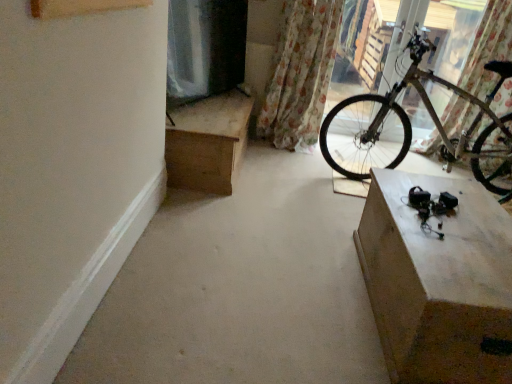
Identify the location of white smooth baseboard at lower left. The width and height of the screenshot is (512, 384). (86, 291).

Where is `floral fabric curtain at upper right, marked as the first curtain in a right-to-left arrangement`? The height and width of the screenshot is (384, 512). floral fabric curtain at upper right, marked as the first curtain in a right-to-left arrangement is located at coordinates (488, 48).

Measure the distance between smooth concrete at center and camera.

smooth concrete at center is 4.68 feet from camera.

Identify the location of wooden desk at upper left. (207, 142).

Can you confirm if metallic silver bicycle at right is smaller than smooth concrete at center?

No, metallic silver bicycle at right is not smaller than smooth concrete at center.

Measure the distance between metallic silver bicycle at right and smooth concrete at center.

They are 1.26 meters apart.

From the image's perspective, would you say metallic silver bicycle at right is shown under smooth concrete at center?

No, from the image's perspective, metallic silver bicycle at right is not below smooth concrete at center.

Is metallic silver bicycle at right inside or outside of smooth concrete at center?

metallic silver bicycle at right is not inside smooth concrete at center, it's outside.

Looking at this image, between wooden desk at upper left and matte concrete cabinet at lower right, which one has more height?

wooden desk at upper left.

Which point is more distant from viewer, (213, 144) or (489, 204)?

Point (213, 144)

Considering their positions, is wooden desk at upper left located in front of or behind matte concrete cabinet at lower right?

Visually, wooden desk at upper left is located behind matte concrete cabinet at lower right.

From a real-world perspective, is floral fabric curtain at upper right, which ranks as the 2th curtain in right-to-left order, on smooth concrete at center?

Indeed, from a real-world perspective, floral fabric curtain at upper right, which ranks as the 2th curtain in right-to-left order, stands above smooth concrete at center.

Is floral fabric curtain at upper right, which ranks as the 2th curtain in right-to-left order, in front of smooth concrete at center?

That is False.

Is floral fabric curtain at upper right, which ranks as the 2th curtain in right-to-left order, bigger than smooth concrete at center?

Incorrect, floral fabric curtain at upper right, which ranks as the 2th curtain in right-to-left order, is not larger than smooth concrete at center.

Is wooden desk at upper left positioned with its back to floral fabric curtain at upper right, marked as the first curtain in a right-to-left arrangement?

wooden desk at upper left is not turned away from floral fabric curtain at upper right, marked as the first curtain in a right-to-left arrangement.

Looking at their sizes, would you say wooden desk at upper left is wider or thinner than floral fabric curtain at upper right, marked as the first curtain in a right-to-left arrangement?

wooden desk at upper left is wider than floral fabric curtain at upper right, marked as the first curtain in a right-to-left arrangement.

Who is shorter, wooden desk at upper left or floral fabric curtain at upper right, which appears as the 2th curtain when viewed from the left?

wooden desk at upper left.

Choose the correct answer: Is wooden desk at upper left inside floral fabric curtain at upper right, marked as the first curtain in a right-to-left arrangement, or outside it?

The correct answer is: outside.

Does point (106, 263) lie behind point (152, 284)?

No, it is not.

Which object is closer to the camera taking this photo, white smooth baseboard at lower left or smooth concrete at center?

white smooth baseboard at lower left.

Is white smooth baseboard at lower left turned away from smooth concrete at center?

No, smooth concrete at center is not at the back of white smooth baseboard at lower left.

Considering the relative positions of white smooth baseboard at lower left and matte concrete cabinet at lower right in the image provided, is white smooth baseboard at lower left in front of matte concrete cabinet at lower right?

Yes.

Based on the photo, is white smooth baseboard at lower left facing towards matte concrete cabinet at lower right?

Yes, white smooth baseboard at lower left faces towards matte concrete cabinet at lower right.

What's the angular difference between white smooth baseboard at lower left and matte concrete cabinet at lower right's facing directions?

179 degrees.

Between white smooth baseboard at lower left and matte concrete cabinet at lower right, which one has smaller width?

Thinner between the two is white smooth baseboard at lower left.

The height and width of the screenshot is (384, 512). Identify the location of desk located above the smooth concrete at center (from the image's perspective). [207, 142].

Does point (287, 332) appear closer or farther from the camera than point (180, 171)?

Point (287, 332) is positioned closer to the camera compared to point (180, 171).

Is smooth concrete at center not inside wooden desk at upper left?

Yes.

Is smooth concrete at center in front of or behind wooden desk at upper left in the image?

smooth concrete at center is in front of wooden desk at upper left.

Where is `concrete lying on the left of metallic silver bicycle at right`? concrete lying on the left of metallic silver bicycle at right is located at coordinates (240, 289).

In the image, there is a matte concrete cabinet at lower right. Where is `desk above it (from the image's perspective)`? desk above it (from the image's perspective) is located at coordinates (207, 142).

In the scene shown: Which object lies nearer to the anchor point smooth concrete at center, white smooth baseboard at lower left or floral fabric curtain at upper right, which is the first curtain in left-to-right order?

white smooth baseboard at lower left lies closer to smooth concrete at center than the other object.

Looking at the image, which one is located closer to floral fabric curtain at upper right, which is the first curtain in left-to-right order, floral fabric curtain at upper right, which appears as the 2th curtain when viewed from the left, or matte concrete cabinet at lower right?

Based on the image, floral fabric curtain at upper right, which appears as the 2th curtain when viewed from the left, appears to be nearer to floral fabric curtain at upper right, which is the first curtain in left-to-right order.

Which object lies further to the anchor point white smooth baseboard at lower left, floral fabric curtain at upper right, which appears as the 2th curtain when viewed from the left, or metallic silver bicycle at right?

floral fabric curtain at upper right, which appears as the 2th curtain when viewed from the left, is further to white smooth baseboard at lower left.

Considering their positions, is matte concrete cabinet at lower right positioned further to white smooth baseboard at lower left than floral fabric curtain at upper right, marked as the first curtain in a right-to-left arrangement?

floral fabric curtain at upper right, marked as the first curtain in a right-to-left arrangement, lies further to white smooth baseboard at lower left than the other object.

Estimate the real-world distances between objects in this image. Which object is closer to smooth concrete at center, metallic silver bicycle at right or white smooth baseboard at lower left?

white smooth baseboard at lower left is positioned closer to the anchor smooth concrete at center.

When comparing their distances from metallic silver bicycle at right, does floral fabric curtain at upper right, which is the first curtain in left-to-right order, or white smooth baseboard at lower left seem further?

white smooth baseboard at lower left is further to metallic silver bicycle at right.

Looking at the image, which one is located further to smooth concrete at center, white smooth baseboard at lower left or metallic silver bicycle at right?

The object further to smooth concrete at center is metallic silver bicycle at right.

Considering their positions, is wooden desk at upper left positioned further to white smooth baseboard at lower left than smooth concrete at center?

wooden desk at upper left is positioned further to the anchor white smooth baseboard at lower left.

Locate an element on the screen. The width and height of the screenshot is (512, 384). concrete between white smooth baseboard at lower left and matte concrete cabinet at lower right is located at coordinates (240, 289).

Locate an element on the screen. The height and width of the screenshot is (384, 512). bicycle between white smooth baseboard at lower left and floral fabric curtain at upper right, marked as the first curtain in a right-to-left arrangement, in the horizontal direction is located at coordinates (433, 121).

Locate an element on the screen. desk between white smooth baseboard at lower left and smooth concrete at center is located at coordinates [x=207, y=142].

Identify the location of desk situated between white smooth baseboard at lower left and matte concrete cabinet at lower right from left to right. (207, 142).